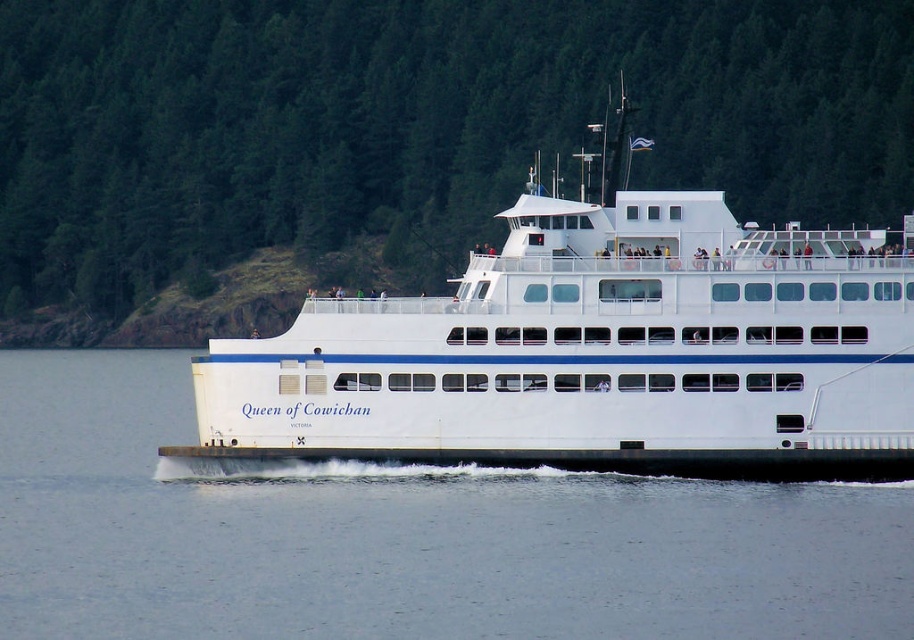
You are a passenger on the white smooth ferry at center and want to take a photo of the white water at center. Since both are in front of you, which one will appear larger in your photo?

The white water at center is closer to the viewer than the white smooth ferry at center, so it will appear larger in the photo.

You are a photographer on the ferry and want to capture the white water at center and the white smooth ferry at center in a single photo. Given that your camera can only focus on one object clearly, which object should you choose to ensure the larger one is in focus?

The white smooth ferry at center is larger than the white water at center, so you should focus on the white smooth ferry at center to ensure the larger one is in focus.